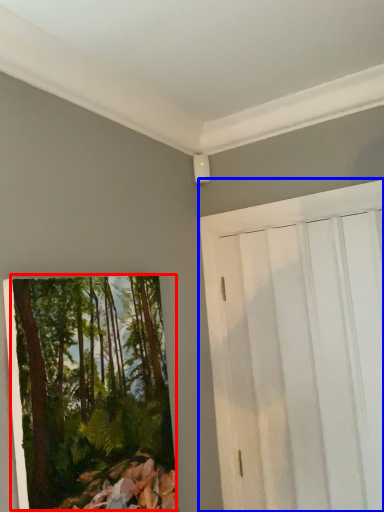
Question: Which point is closer to the camera, tree (highlighted by a red box) or barn door (highlighted by a blue box)?

Choices:
 (A) tree
 (B) barn door

Answer: (A)